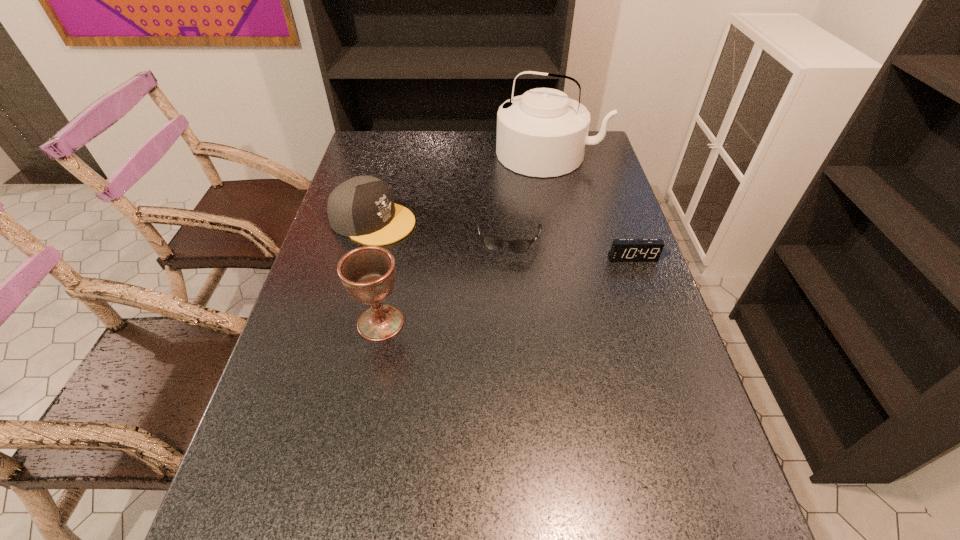
Identify the location of cap present at the left edge. (362, 208).

Find the location of a particular element. alarm clock that is at the right edge is located at coordinates (623, 250).

Identify the location of kettle present at the right edge. (543, 133).

Where is `object present at the far right corner`? Image resolution: width=960 pixels, height=540 pixels. object present at the far right corner is located at coordinates (543, 133).

At what (x,y) coordinates should I click in order to perform the action: click on vacant area at the far edge. Please return your answer as a coordinate pair (x, y). The width and height of the screenshot is (960, 540). Looking at the image, I should click on (453, 150).

Locate an element on the screen. free region at the left edge is located at coordinates click(351, 173).

The width and height of the screenshot is (960, 540). I want to click on vacant region at the right edge, so click(x=590, y=224).

This screenshot has height=540, width=960. I want to click on vacant space at the far left corner of the desktop, so click(387, 155).

Image resolution: width=960 pixels, height=540 pixels. In the image, there is a desktop. Identify the location of free region at the near right corner. (644, 488).

I want to click on free point between the sunglasses and the cap, so click(442, 230).